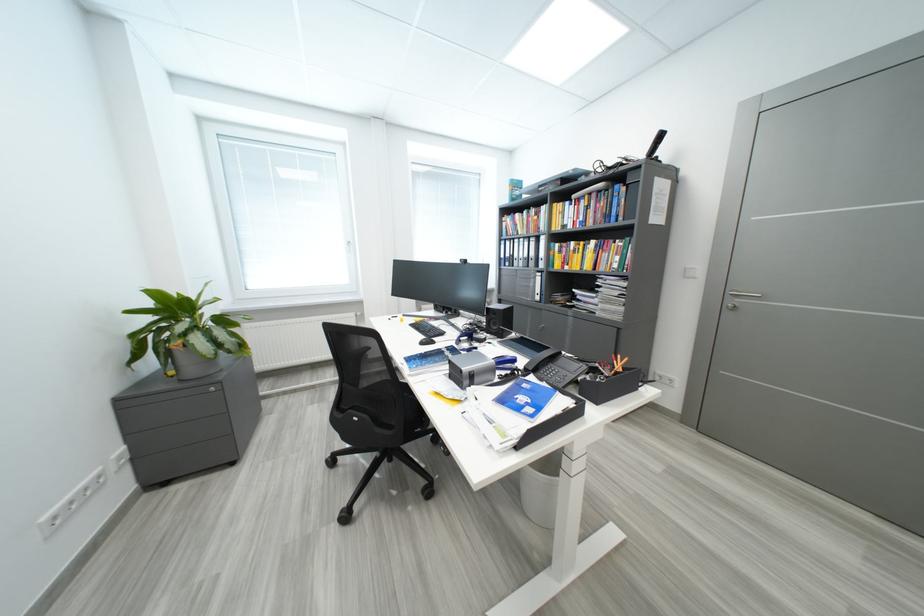
The location [426,341] corresponds to which object?

It refers to a black computer mouse.